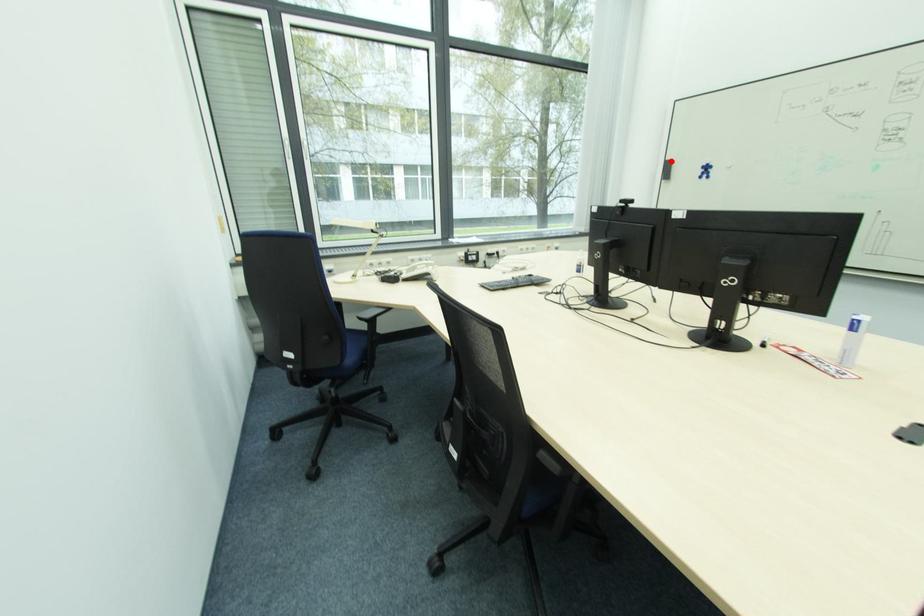
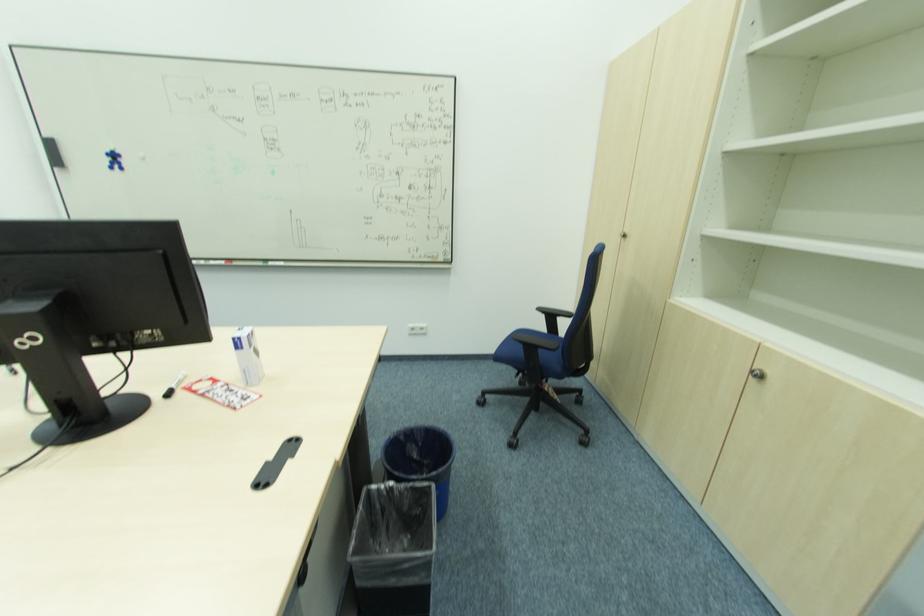
Question: I am providing you with two images of the same scene from different viewpoints. A red point is shown in image1. For the corresponding object point in image2, is it positioned nearer or farther from the camera?

Choices:
 (A) Nearer
 (B) Farther

Answer: (B)